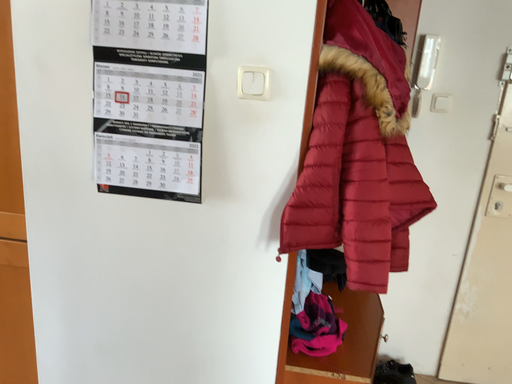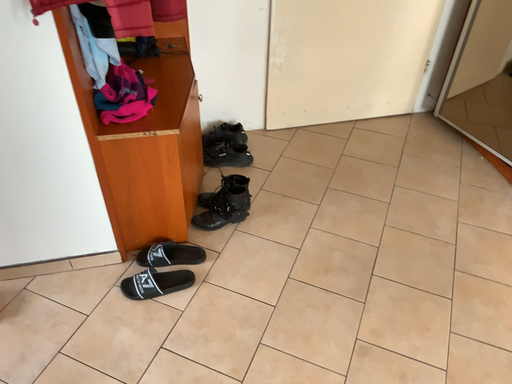
Question: How did the camera likely rotate when shooting the video?

Choices:
 (A) rotated left
 (B) rotated right

Answer: (B)